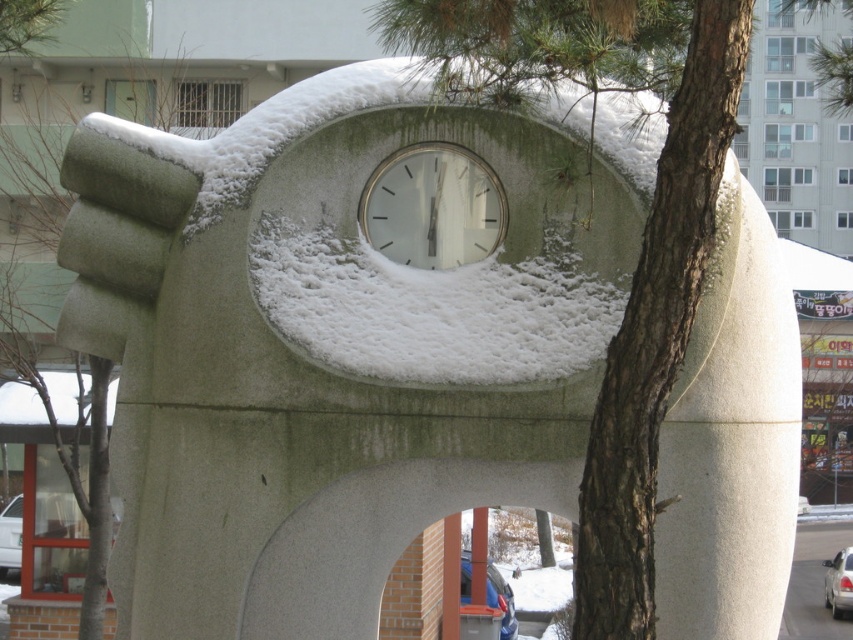
Question: Can you confirm if white fluffy snow at center is bigger than metallic blue pole at center?

Choices:
 (A) yes
 (B) no

Answer: (B)

Question: Does white fluffy snow at center come behind brown rough bark at center?

Choices:
 (A) no
 (B) yes

Answer: (B)

Question: Among these points, which one is farthest from the camera?

Choices:
 (A) (474, 595)
 (B) (437, 262)
 (C) (584, 364)

Answer: (A)

Question: Considering the real-world distances, which object is farthest from the metallic blue pole at center?

Choices:
 (A) brown rough bark at center
 (B) white fluffy snow at center
 (C) white matte clock at center

Answer: (A)

Question: From the image, what is the correct spatial relationship of white fluffy snow at center in relation to brown rough bark at center?

Choices:
 (A) right
 (B) left

Answer: (B)

Question: Considering the real-world distances, which object is farthest from the white matte clock at center?

Choices:
 (A) brown rough bark at center
 (B) metallic blue pole at center
 (C) white fluffy snow at center

Answer: (A)